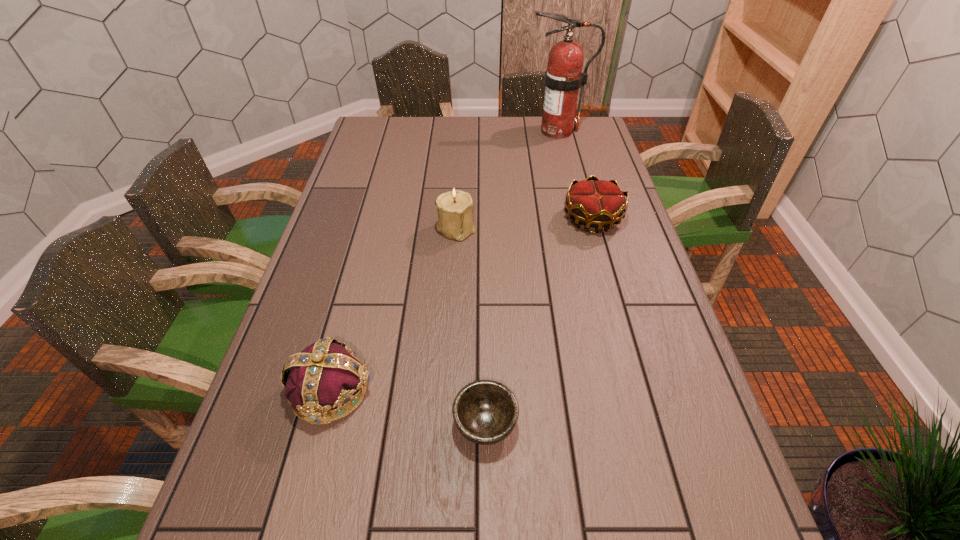
The image size is (960, 540). I want to click on vacant space that's between the farthest object and the bowl, so click(x=521, y=277).

This screenshot has width=960, height=540. What are the coordinates of `vacant space in between the taller crown and the second shortest object` in the screenshot? It's located at (462, 304).

The image size is (960, 540). In order to click on free space between the bowl and the farther crown in this screenshot , I will do `click(539, 321)`.

Identify the location of free spot between the shortest object and the fire extinguisher. (521, 277).

Locate an element on the screen. This screenshot has height=540, width=960. object that ranks as the second closest to the bowl is located at coordinates (455, 208).

Point out which object is positioned as the fourth nearest to the candle_holder. Please provide its 2D coordinates. Your answer should be formatted as a tuple, i.e. [(x, y)], where the tuple contains the x and y coordinates of a point satisfying the conditions above.

[(563, 78)]

What are the coordinates of `free location that satisfies the following two spatial constraints: 1. at the nozzle of the farthest object; 2. on the front side of the candle_holder` in the screenshot? It's located at (581, 228).

Locate an element on the screen. The width and height of the screenshot is (960, 540). free space that satisfies the following two spatial constraints: 1. on the back side of the bowl; 2. on the right side of the right crown is located at coordinates (484, 218).

Locate an element on the screen. vacant space that satisfies the following two spatial constraints: 1. on the front side of the shortest object; 2. on the left side of the candle_holder is located at coordinates (444, 423).